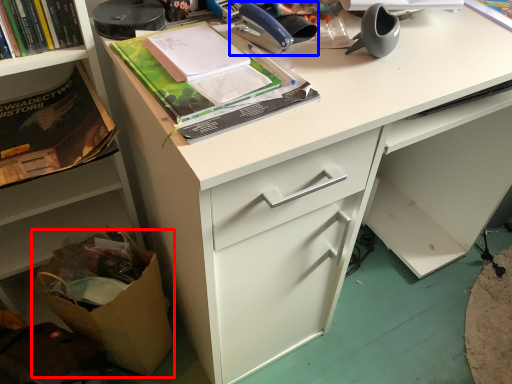
Question: Among these objects, which one is nearest to the camera, cardboard box (highlighted by a red box) or office supplies (highlighted by a blue box)?

Choices:
 (A) cardboard box
 (B) office supplies

Answer: (B)